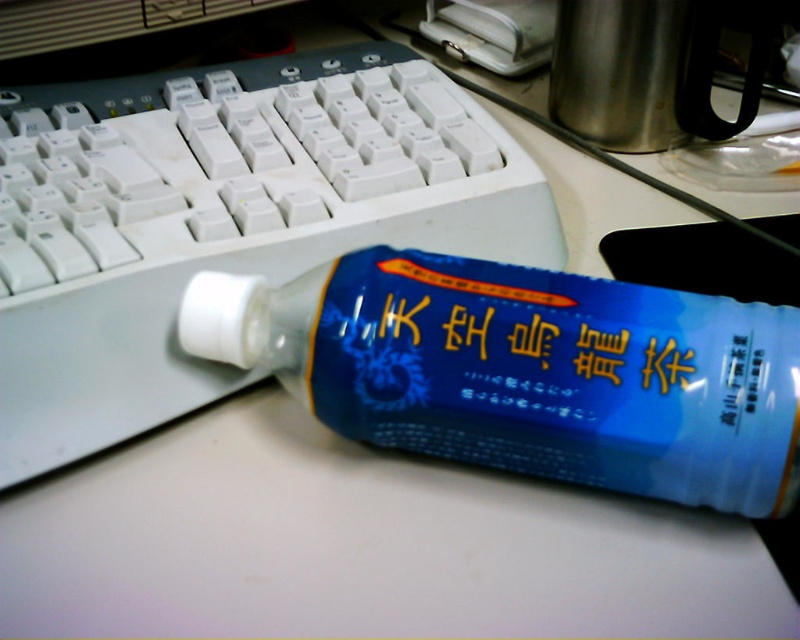
How distant is white plastic keyboard at center from blue plastic bottle at center?

white plastic keyboard at center is 5.74 inches away from blue plastic bottle at center.

Based on the photo, can you confirm if white plastic keyboard at center is wider than blue plastic bottle at center?

Yes.

Does point (264, 228) come behind point (678, 304)?

Yes, it is.

Find the location of a particular element. The height and width of the screenshot is (640, 800). white plastic keyboard at center is located at coordinates (220, 220).